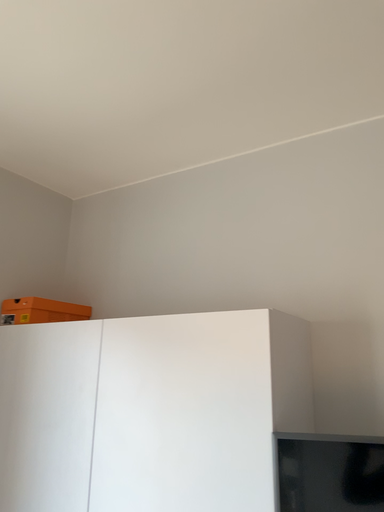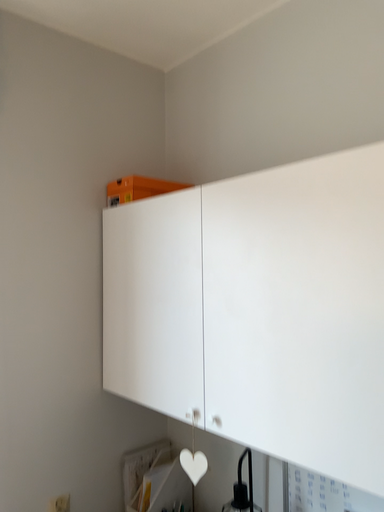
Question: Which way did the camera rotate in the video?

Choices:
 (A) rotated left
 (B) rotated right

Answer: (A)